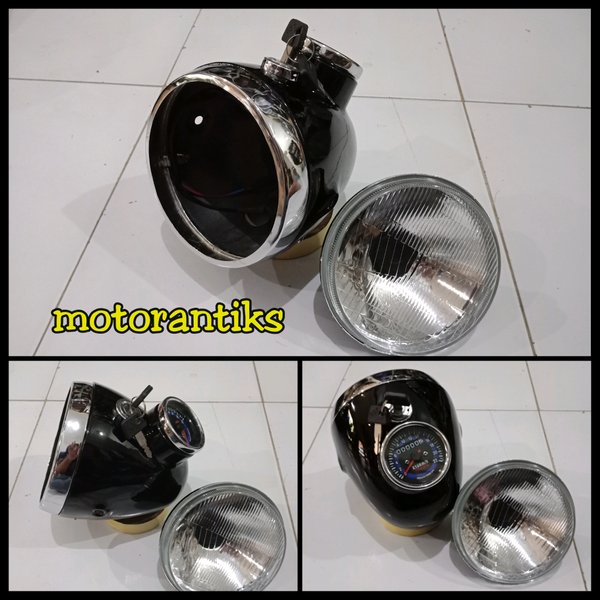
Where is `keys`? Image resolution: width=600 pixels, height=600 pixels. keys is located at coordinates (378, 413), (395, 398), (136, 416), (143, 393), (295, 28), (306, 68).